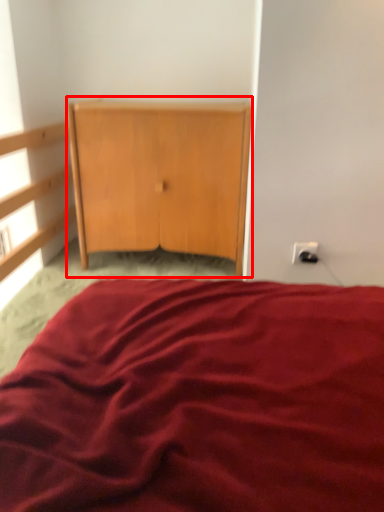
Question: From the image's perspective, what is the correct spatial positioning of cupboard (annotated by the red box) in reference to electric outlet?

Choices:
 (A) above
 (B) below

Answer: (A)